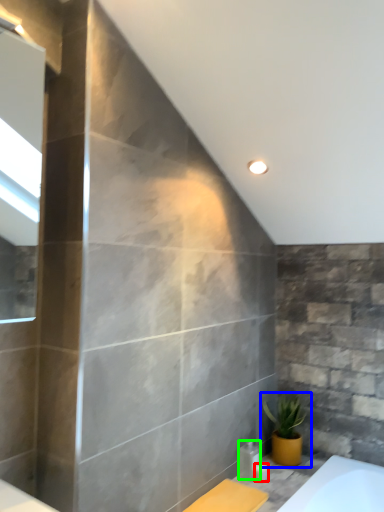
Question: Considering the real-world distances, which object is closest to toiletry (highlighted by a red box)? houseplant (highlighted by a blue box) or toiletry (highlighted by a green box).

Choices:
 (A) houseplant
 (B) toiletry

Answer: (B)